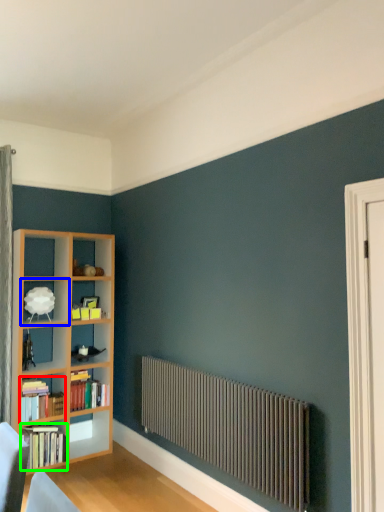
Question: Which object is positioned farthest from book (highlighted by a red box)? Select from shelf (highlighted by a blue box) and book (highlighted by a green box).

Choices:
 (A) shelf
 (B) book

Answer: (A)